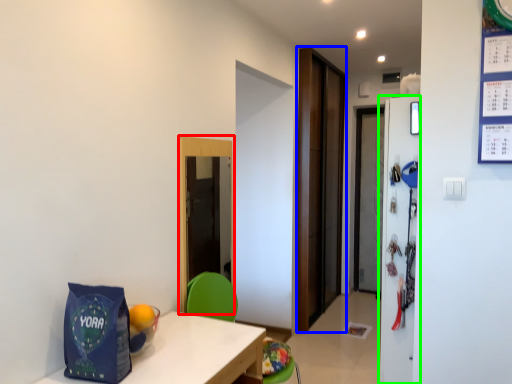
Question: Which object is the farthest from glass door (highlighted by a red box)? Choose among these: door (highlighted by a blue box) or refrigerator (highlighted by a green box).

Choices:
 (A) door
 (B) refrigerator

Answer: (A)